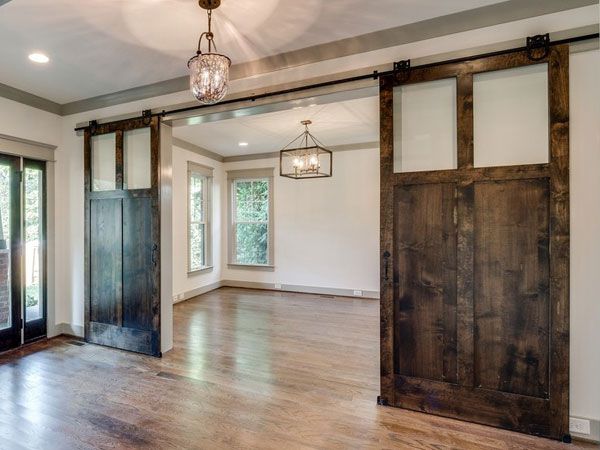
Find the location of `windows`. windows is located at coordinates (246, 243), (198, 236).